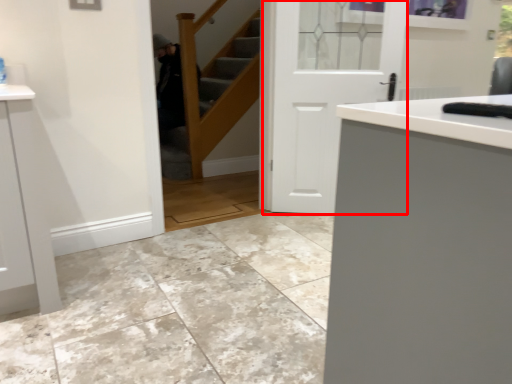
Question: From the image, what is the correct spatial relationship of door (annotated by the red box) in relation to stairwell?

Choices:
 (A) left
 (B) right

Answer: (B)